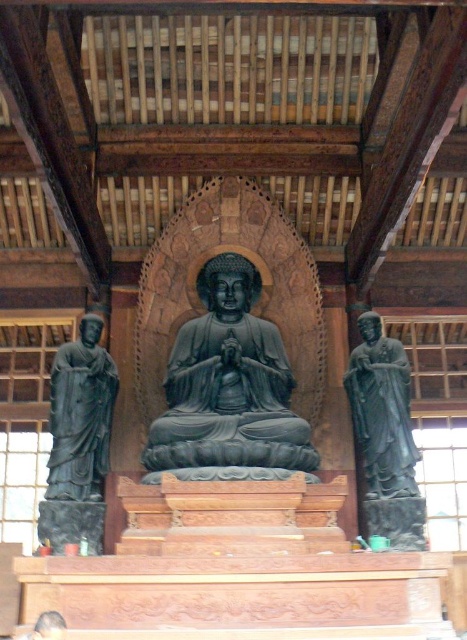
Question: Which point is closer to the camera?

Choices:
 (A) (169, 404)
 (B) (372, 397)
 (C) (99, 433)

Answer: (C)

Question: Is matte black statue at left below black polished statue at right?

Choices:
 (A) yes
 (B) no

Answer: (A)

Question: Which object appears closest to the camera in this image?

Choices:
 (A) black polished statue at right
 (B) black stone statue at center
 (C) matte black statue at left

Answer: (B)

Question: Where is black stone statue at center located in relation to black polished statue at right in the image?

Choices:
 (A) right
 (B) left

Answer: (B)

Question: Estimate the real-world distances between objects in this image. Which object is closer to the black polished statue at right?

Choices:
 (A) black stone statue at center
 (B) matte black statue at left

Answer: (A)

Question: Is black stone statue at center to the right of black polished statue at right from the viewer's perspective?

Choices:
 (A) yes
 (B) no

Answer: (B)